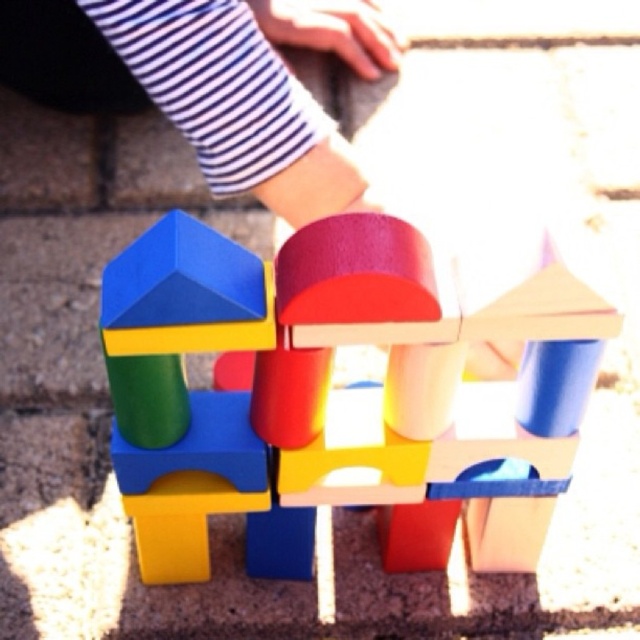
You are a child who wants to reach the wooden blocks at center to continue building your structure. If your arm can extend 28 inches, will you be able to reach them?

The wooden blocks at center are 29.71 inches away from the viewer. Since your arm can only extend 28 inches, you cannot reach them.

You are a child trying to build a tower using the wooden blocks at center and the striped fabric at upper center. Which object has a greater width and can provide a more stable base?

The wooden blocks at center have a greater width than the striped fabric at upper center, making them a better choice for a stable base.